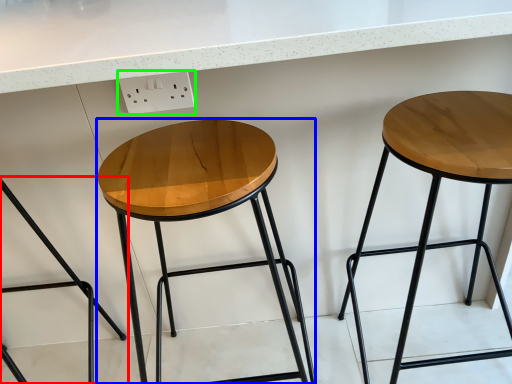
Question: Estimate the real-world distances between objects in this image. Which object is farther from stool (highlighted by a red box), stool (highlighted by a blue box) or electric outlet (highlighted by a green box)?

Choices:
 (A) stool
 (B) electric outlet

Answer: (B)